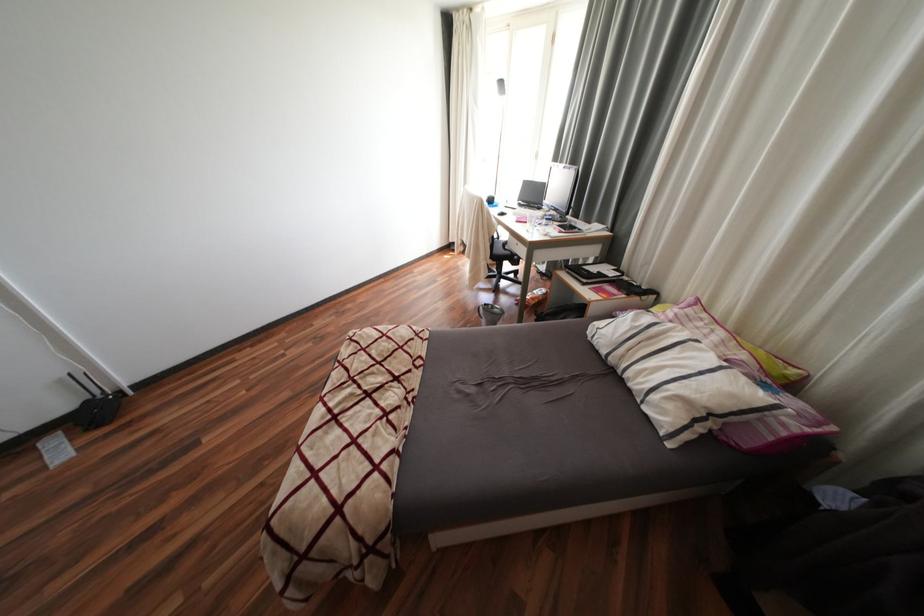
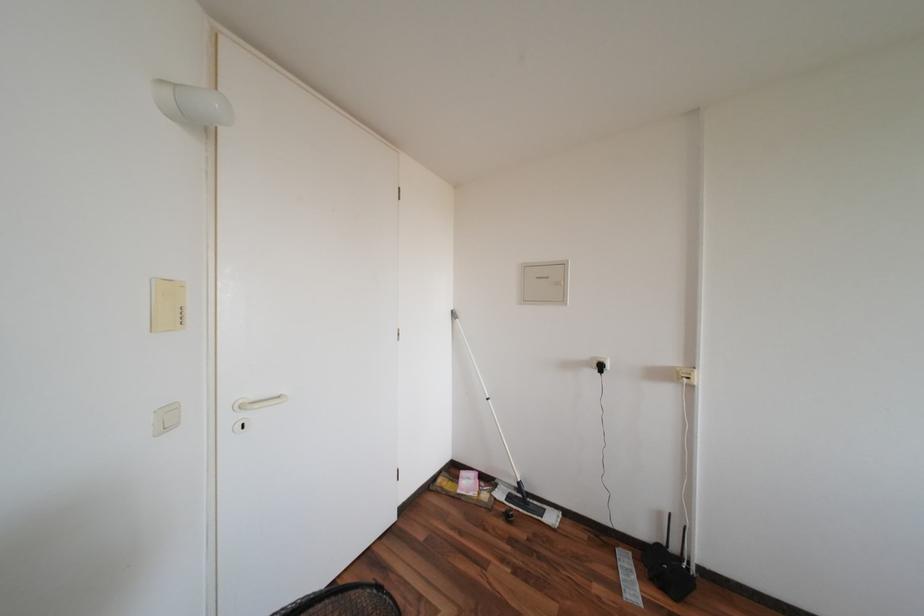
Question: Based on the continuous images, in which direction is the camera rotating? Reply with the corresponding letter.

Choices:
 (A) Left
 (B) Right
 (C) Up
 (D) Down

Answer: (A)